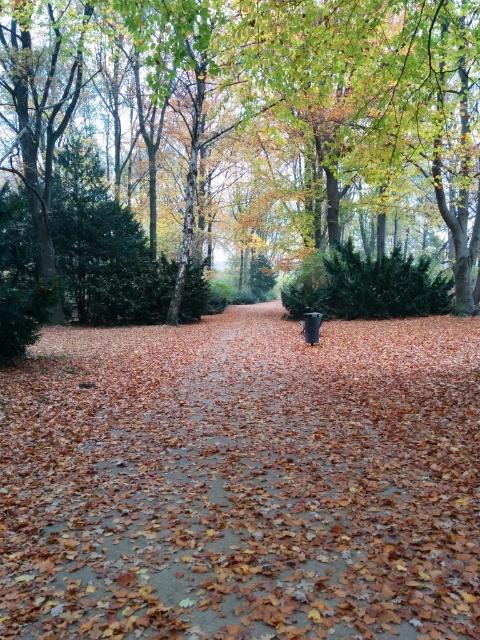
Is point (452, 410) positioned behind point (20, 52)?

No, it is not.

Is point (40, 554) positioned behind point (374, 74)?

That is False.

Find the location of a particular element. brown leafy path at center is located at coordinates (242, 481).